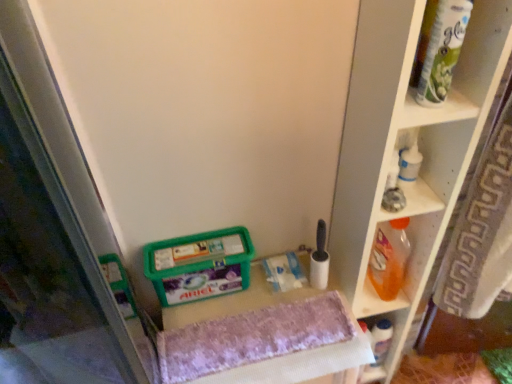
Question: Can you confirm if orange plastic bottle at right is shorter than white plastic bottle at lower right, the 1th shelf in the bottom-to-top sequence?

Choices:
 (A) yes
 (B) no

Answer: (B)

Question: Does orange plastic bottle at right turn towards white plastic bottle at lower right, the 1th shelf in the bottom-to-top sequence?

Choices:
 (A) no
 (B) yes

Answer: (A)

Question: Can you see orange plastic bottle at right touching white plastic bottle at lower right, positioned as the 2th shelf in top-to-bottom order?

Choices:
 (A) no
 (B) yes

Answer: (A)

Question: Are orange plastic bottle at right and white plastic bottle at lower right, positioned as the 2th shelf in top-to-bottom order, located far from each other?

Choices:
 (A) yes
 (B) no

Answer: (B)

Question: Is orange plastic bottle at right behind white plastic bottle at lower right, positioned as the 2th shelf in top-to-bottom order?

Choices:
 (A) yes
 (B) no

Answer: (B)

Question: From a real-world perspective, is orange plastic bottle at right positioned under white plastic bottle at lower right, positioned as the 2th shelf in top-to-bottom order, based on gravity?

Choices:
 (A) yes
 (B) no

Answer: (B)

Question: Is green plastic container at lower center thinner than orange plastic bottle at right?

Choices:
 (A) yes
 (B) no

Answer: (A)

Question: Is green plastic container at lower center taller than orange plastic bottle at right?

Choices:
 (A) yes
 (B) no

Answer: (B)

Question: From a real-world perspective, is green plastic container at lower center below orange plastic bottle at right?

Choices:
 (A) yes
 (B) no

Answer: (B)

Question: Does green plastic container at lower center lie in front of orange plastic bottle at right?

Choices:
 (A) yes
 (B) no

Answer: (A)

Question: Is green plastic container at lower center far from orange plastic bottle at right?

Choices:
 (A) yes
 (B) no

Answer: (B)

Question: Can you confirm if green plastic container at lower center is smaller than orange plastic bottle at right?

Choices:
 (A) no
 (B) yes

Answer: (A)

Question: Does green plastic container at lower center have a greater width compared to white plastic bottle at lower right, positioned as the 2th shelf in top-to-bottom order?

Choices:
 (A) yes
 (B) no

Answer: (A)